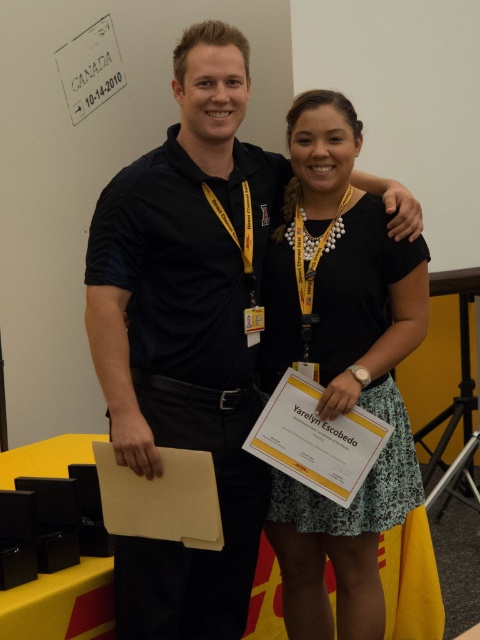
Where is the black matte shirt at upper left located in the image?

The black matte shirt at upper left is located at point (186, 333).

You are standing in a room where there are two people. You see a black matte shirt at upper left represented by point (186, 333). Can you determine the position of the black matte shirt at upper left relative to the other person?

The black matte shirt at upper left represented by point (186, 333) is located at the upper left position, but without information about the other person, it is impossible to determine their exact relative positions.

Consider the image. You are at a professional event and need to locate two specific points marked on the floor. The first point is labeled as point [242,550] and the second is point [409,266]. If you are facing the direction of the event entrance, which point would you encounter first while moving straight ahead?

Point [242,550] is in front of point [409,266], so you would encounter point [242,550] first while moving straight ahead.